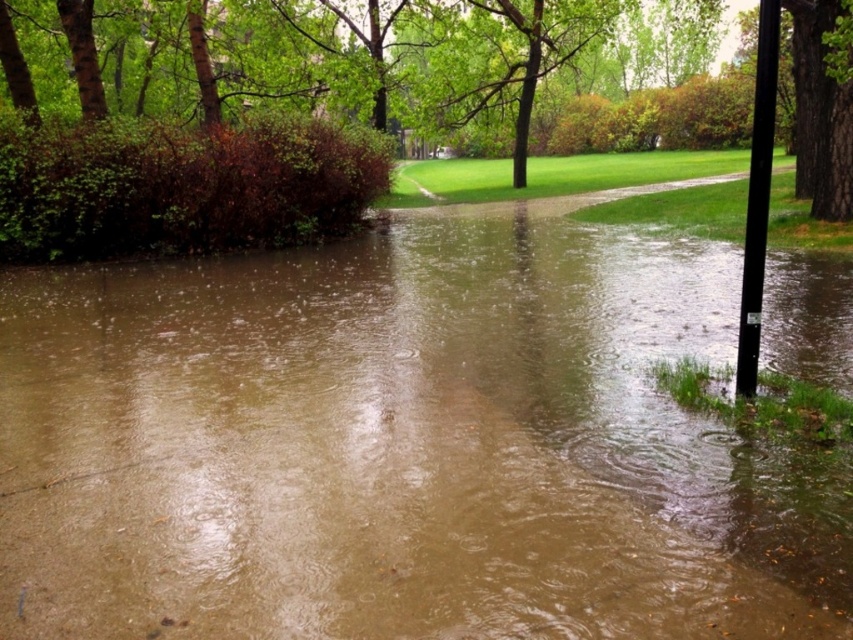
Question: Can you confirm if brown muddy water at center is positioned below black smooth pole at right?

Choices:
 (A) yes
 (B) no

Answer: (A)

Question: Estimate the real-world distances between objects in this image. Which object is closer to the brown muddy water at center?

Choices:
 (A) brown rough bark tree at upper right
 (B) black smooth pole at right

Answer: (B)

Question: Among these objects, which one is nearest to the camera?

Choices:
 (A) brown rough bark tree at upper right
 (B) brown muddy water at center

Answer: (B)

Question: Is brown muddy water at center bigger than black smooth pole at right?

Choices:
 (A) yes
 (B) no

Answer: (B)

Question: Does brown rough bark tree at upper right have a smaller size compared to black smooth pole at right?

Choices:
 (A) no
 (B) yes

Answer: (A)

Question: Among these objects, which one is farthest from the camera?

Choices:
 (A) brown rough bark tree at upper right
 (B) black smooth pole at right

Answer: (A)